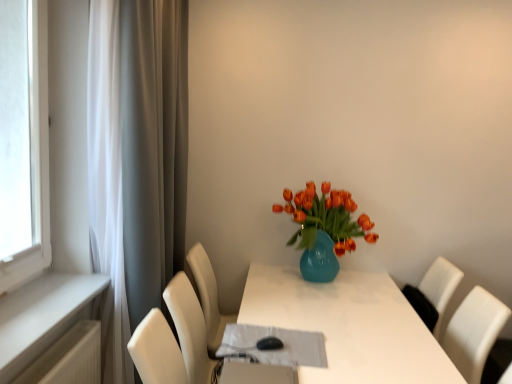
Question: Is white matte curtain at left smaller than matte blue vase with orange tulips at center?

Choices:
 (A) no
 (B) yes

Answer: (A)

Question: From the image's perspective, is white matte curtain at left located beneath matte blue vase with orange tulips at center?

Choices:
 (A) yes
 (B) no

Answer: (B)

Question: Is white matte curtain at left wider than matte blue vase with orange tulips at center?

Choices:
 (A) yes
 (B) no

Answer: (B)

Question: From a real-world perspective, is white matte curtain at left located beneath matte blue vase with orange tulips at center?

Choices:
 (A) no
 (B) yes

Answer: (A)

Question: Considering the relative positions of white matte curtain at left and matte blue vase with orange tulips at center in the image provided, is white matte curtain at left in front of matte blue vase with orange tulips at center?

Choices:
 (A) no
 (B) yes

Answer: (B)

Question: Considering the positions of white painted wood at left and white glossy table at center in the image, is white painted wood at left wider or thinner than white glossy table at center?

Choices:
 (A) wide
 (B) thin

Answer: (B)

Question: Does point (75, 304) appear closer or farther from the camera than point (329, 324)?

Choices:
 (A) farther
 (B) closer

Answer: (B)

Question: Based on their positions, is white painted wood at left located to the left or right of white glossy table at center?

Choices:
 (A) left
 (B) right

Answer: (A)

Question: In the image, is white painted wood at left positioned in front of or behind white glossy table at center?

Choices:
 (A) behind
 (B) front

Answer: (B)

Question: From the image's perspective, is white painted wood at left positioned above or below matte blue vase with orange tulips at center?

Choices:
 (A) below
 (B) above

Answer: (A)

Question: Considering the positions of white painted wood at left and matte blue vase with orange tulips at center in the image, is white painted wood at left wider or thinner than matte blue vase with orange tulips at center?

Choices:
 (A) wide
 (B) thin

Answer: (B)

Question: Is white painted wood at left taller or shorter than matte blue vase with orange tulips at center?

Choices:
 (A) tall
 (B) short

Answer: (B)

Question: Relative to matte blue vase with orange tulips at center, is white painted wood at left in front or behind?

Choices:
 (A) behind
 (B) front

Answer: (B)

Question: Choose the correct answer: Is white glossy table at center inside white matte curtain at left or outside it?

Choices:
 (A) outside
 (B) inside

Answer: (A)

Question: Is white glossy table at center bigger or smaller than white matte curtain at left?

Choices:
 (A) big
 (B) small

Answer: (A)